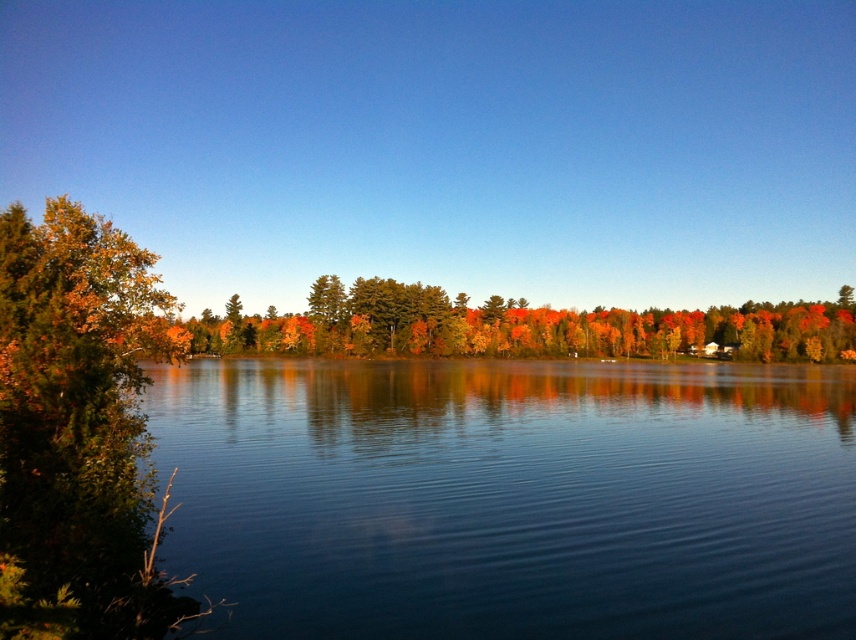
Question: Estimate the real-world distances between objects in this image. Which object is farther from the green leafy tree at left?

Choices:
 (A) clear water at center
 (B) autumn leaves at center

Answer: (B)

Question: Does clear water at center have a smaller size compared to green leafy tree at left?

Choices:
 (A) no
 (B) yes

Answer: (A)

Question: Is green leafy tree at left above autumn leaves at center?

Choices:
 (A) yes
 (B) no

Answer: (B)

Question: Which object appears closest to the camera in this image?

Choices:
 (A) clear water at center
 (B) autumn leaves at center

Answer: (A)

Question: Which is farther from the clear water at center?

Choices:
 (A) green leafy tree at left
 (B) autumn leaves at center

Answer: (B)

Question: Where is clear water at center located in relation to green leafy tree at left in the image?

Choices:
 (A) above
 (B) below

Answer: (B)